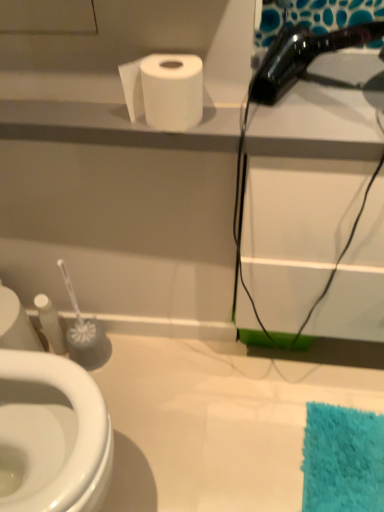
Find the location of `vacant space positioned to the left of white matte toilet paper at upper center`. vacant space positioned to the left of white matte toilet paper at upper center is located at coordinates (99, 119).